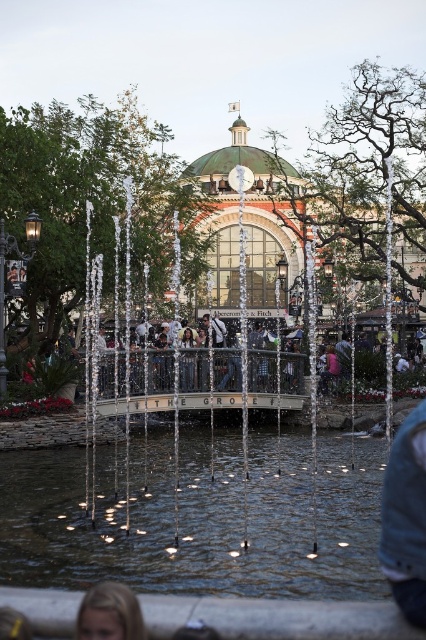
In the scene shown: Who is more forward, (150, 538) or (408, 458)?

Point (408, 458) is more forward.

Which is more to the left, clear water at center or denim jacket at lower right?

clear water at center

I want to click on clear water at center, so click(198, 518).

Can you confirm if clear water at center is thinner than blonde hair at lower left?

In fact, clear water at center might be wider than blonde hair at lower left.

Can you confirm if clear water at center is positioned above blonde hair at lower left?

Correct, clear water at center is located above blonde hair at lower left.

From the picture: Who is more forward, (273, 538) or (89, 621)?

Positioned in front is point (89, 621).

Image resolution: width=426 pixels, height=640 pixels. I want to click on clear water at center, so click(x=198, y=518).

Can you confirm if denim jacket at lower right is positioned below blonde hair at lower left?

Incorrect, denim jacket at lower right is not positioned below blonde hair at lower left.

Does denim jacket at lower right have a greater width compared to blonde hair at lower left?

Yes, denim jacket at lower right is wider than blonde hair at lower left.

What do you see at coordinates (405, 516) in the screenshot?
I see `denim jacket at lower right` at bounding box center [405, 516].

This screenshot has width=426, height=640. I want to click on denim jacket at lower right, so click(405, 516).